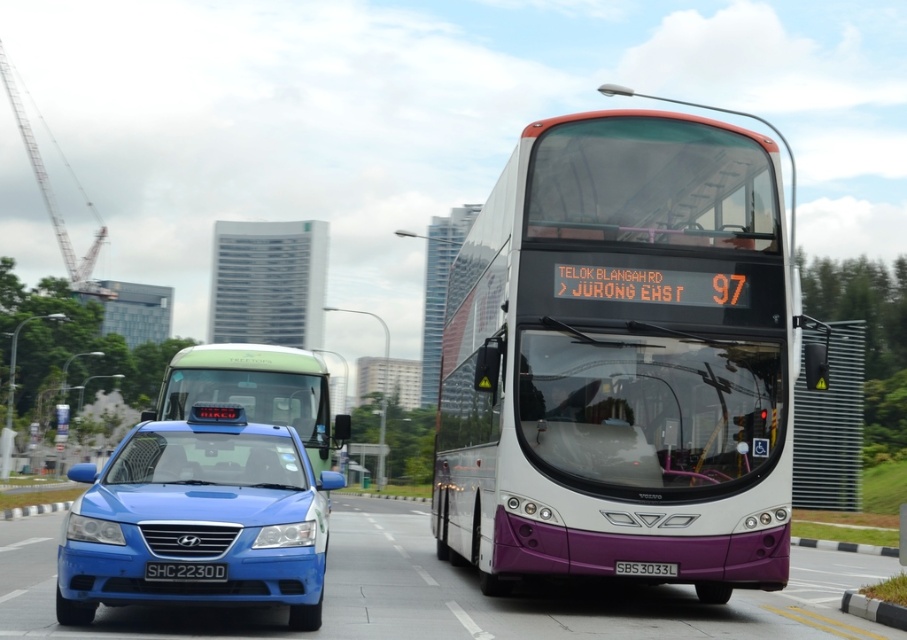
You are a delivery driver who needs to park your truck near the black plastic license plate at center. However, there is a metallic gray crane at left in the way. Based on the scene, can your truck pass under the crane without hitting it?

The metallic gray crane at left is taller than the black plastic license plate at center. Since the license plate is at the center, the crane is positioned to the left and is taller, so the truck should be able to pass under the crane without hitting it as long as it stays on the correct path.

You are standing at the point marked by the coordinates [256,390] in the image. Which vehicle are you closest to?

You are closest to the green matte taxi at left because the point [256,390] corresponds to its location.

From the picture: You are a city planner analyzing traffic flow and need to know the relative sizes of the metallic gray crane at left and the black plastic license plate at center. Which object is wider?

The metallic gray crane at left is wider than the black plastic license plate at center according to the description.